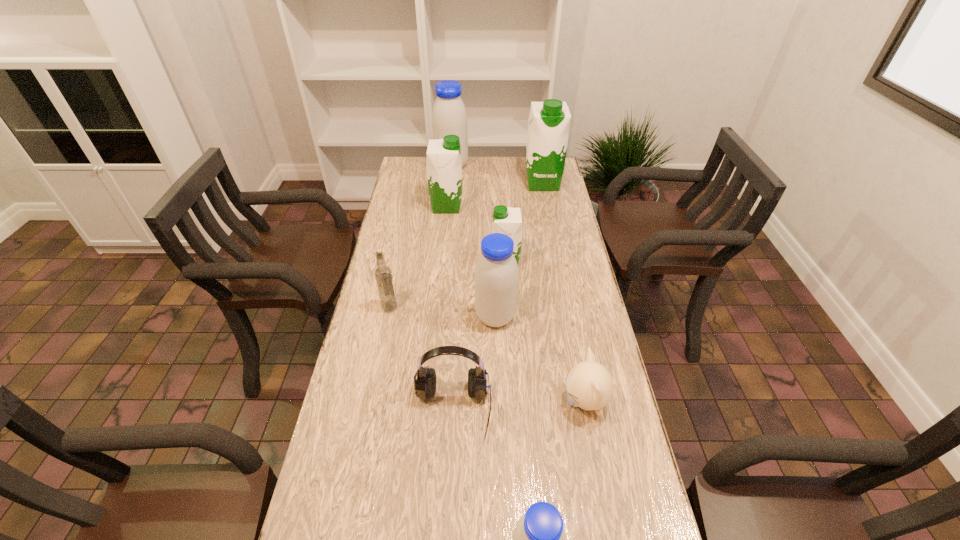
Locate an element on the screen. vacant space at the far edge is located at coordinates (492, 166).

At what (x,y) coordinates should I click in order to perform the action: click on free space at the left edge of the desktop. Please return your answer as a coordinate pair (x, y). This screenshot has width=960, height=540. Looking at the image, I should click on (410, 325).

Identify the location of free location at the right edge. (567, 259).

This screenshot has height=540, width=960. In order to click on free point at the far left corner in this screenshot , I will do `click(399, 178)`.

The width and height of the screenshot is (960, 540). What are the coordinates of `free area in between the rightmost green soya milk and the nearest green soya milk` in the screenshot? It's located at (524, 222).

Find the location of `vacant area that lies between the fourth farthest soya milk and the vodka`. vacant area that lies between the fourth farthest soya milk and the vodka is located at coordinates (447, 285).

Locate an element on the screen. The image size is (960, 540). free space between the shortest object and the second smallest blue soya milk is located at coordinates (540, 360).

This screenshot has width=960, height=540. Find the location of `empty space that is in between the kitten and the leftmost blue soya milk`. empty space that is in between the kitten and the leftmost blue soya milk is located at coordinates (518, 284).

Locate an element on the screen. The height and width of the screenshot is (540, 960). empty space that is in between the third nearest soya milk and the farthest green soya milk is located at coordinates (524, 222).

Locate an element on the screen. Image resolution: width=960 pixels, height=540 pixels. vacant region between the second shortest object and the third nearest soya milk is located at coordinates (479, 336).